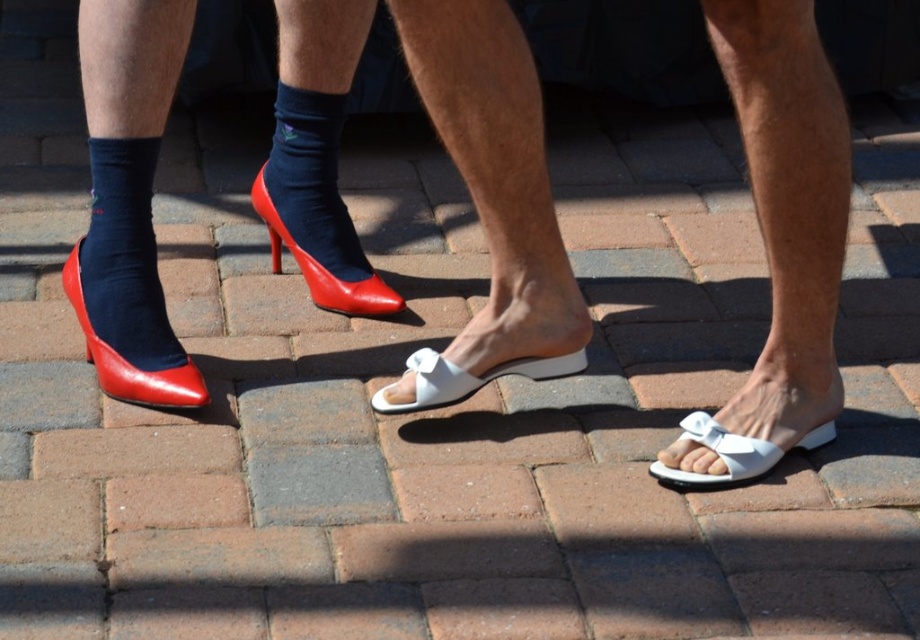
Question: Which of the following is the closest to the observer?

Choices:
 (A) (302, 243)
 (B) (161, 388)

Answer: (B)

Question: Among these objects, which one is farthest from the camera?

Choices:
 (A) matte red high-heeled shoe at left
 (B) white leather sandal at center
 (C) shiny red high-heeled shoe at center-left
 (D) white matte sandal at lower right

Answer: (C)

Question: Does matte red high-heeled shoe at left appear under white matte sandal at lower right?

Choices:
 (A) no
 (B) yes

Answer: (A)

Question: Can you confirm if matte black sock at center is smaller than matte red high-heeled shoe at left?

Choices:
 (A) yes
 (B) no

Answer: (B)

Question: Which of the following is the closest to the observer?

Choices:
 (A) black smooth sock at left
 (B) matte red high-heeled shoe at left

Answer: (B)

Question: Can you confirm if matte black sock at center is smaller than matte red high-heeled shoe at left?

Choices:
 (A) yes
 (B) no

Answer: (B)